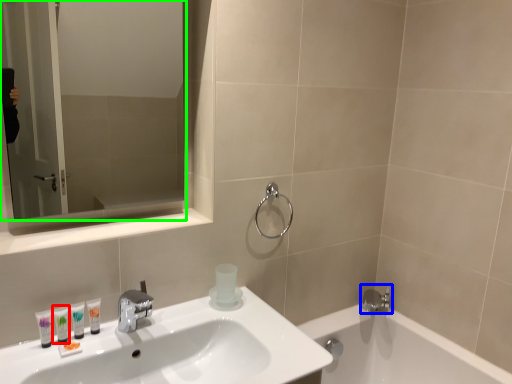
Question: Estimate the real-world distances between objects in this image. Which object is farther from mouthwash (highlighted by a red box), tap (highlighted by a blue box) or mirror (highlighted by a green box)?

Choices:
 (A) tap
 (B) mirror

Answer: (B)